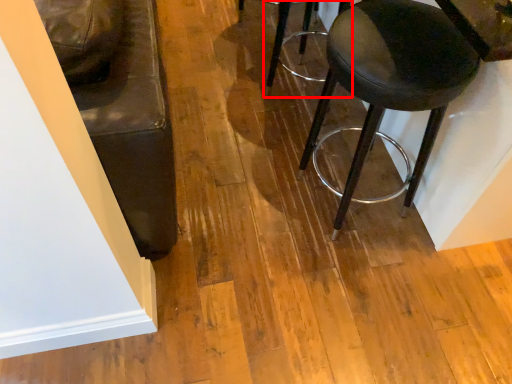
Question: Considering the relative positions of stool (annotated by the red box) and stool in the image provided, where is stool (annotated by the red box) located with respect to the staircase?

Choices:
 (A) right
 (B) left

Answer: (B)